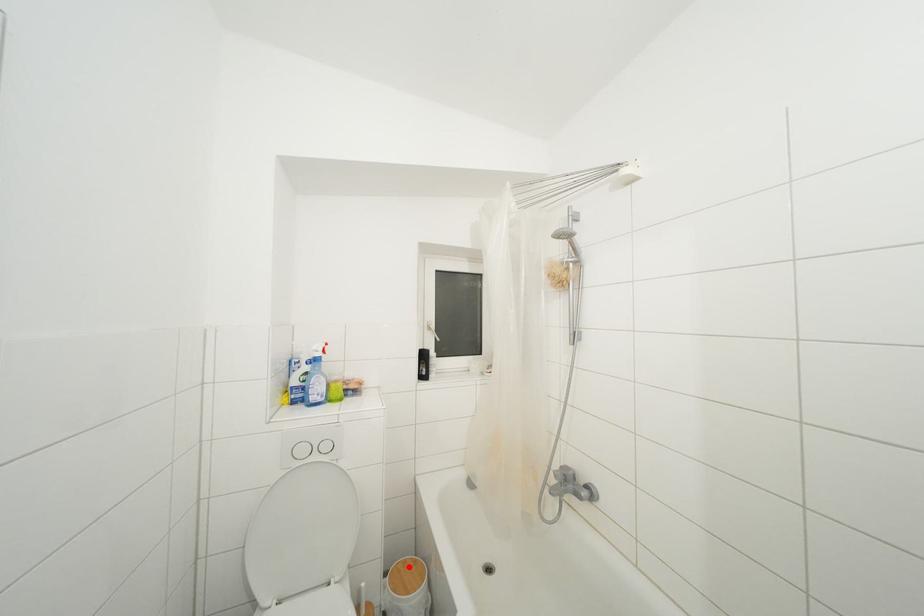
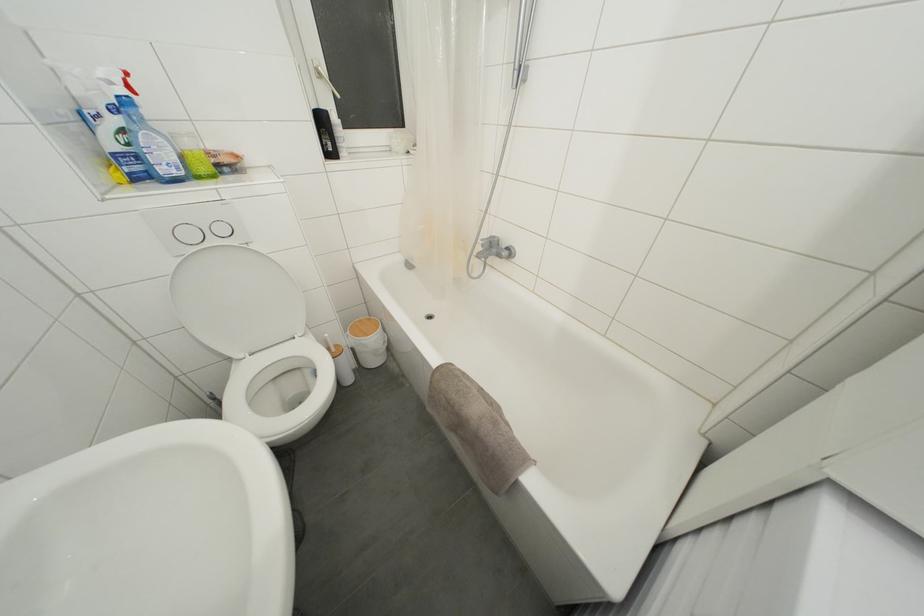
Question: I am providing you with two images of the same scene from different viewpoints. In image1, a red point is highlighted. Considering the same 3D point in image2, which of the following is correct?

Choices:
 (A) It is closer
 (B) It is farther

Answer: (A)